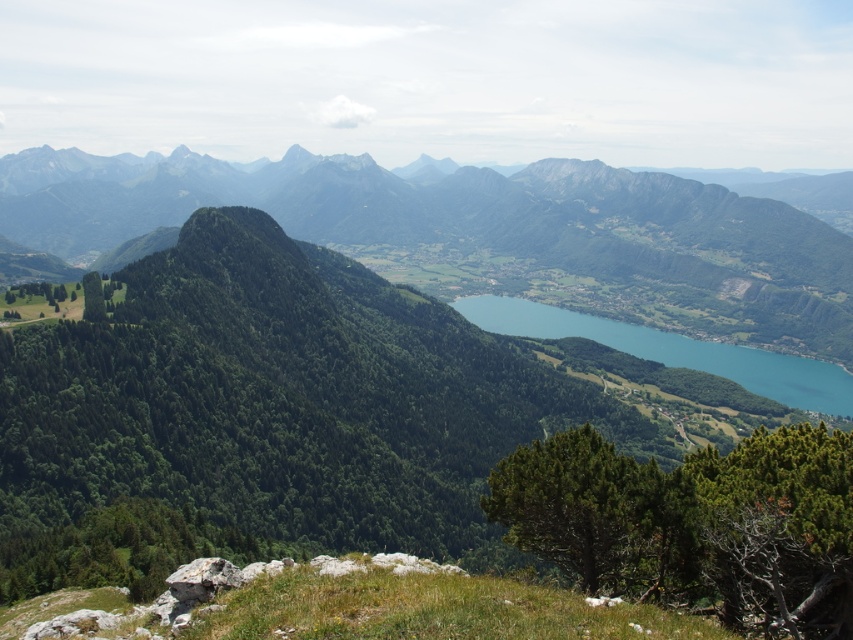
You are a hiker planning to cross from the green forested mountain at center to the blue glassy lake at center. Can you safely walk directly between them if your path requires a distance of 150 meters? Please explain using the given measurements.

The distance between the green forested mountain at center and the blue glassy lake at center is 146.06 meters. Since your required path is 150 meters, which is longer than the actual distance between them, you cannot safely walk directly between them as the distance is insufficient.

You are a hiker planning to cross the blue glassy lake at center using a 10m wide raft. Given the green forested mountain at center, can you safely navigate the raft across the lake without touching the mountain?

The green forested mountain at center might be wider than the blue glassy lake at center. If the mountain is indeed wider, the lake might be narrower than the mountain, so the 10m wide raft may not fit safely between the edges of the mountain. However, since the exact width isn

You are a hiker planning to take a photo of the green forested mountain at center and the blue glassy lake at center from this vantage point. Which object should you focus on first if you want to capture both in a single frame without moving the camera?

You should focus on the green forested mountain at center first because it is larger in size than the blue glassy lake at center, allowing it to dominate the frame while still including the lake in the background.